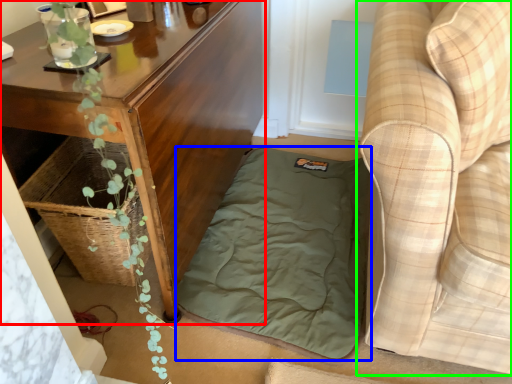
Question: Which object is positioned closest to table (highlighted by a red box)? Select from mattress (highlighted by a blue box) and studio couch (highlighted by a green box).

Choices:
 (A) mattress
 (B) studio couch

Answer: (A)